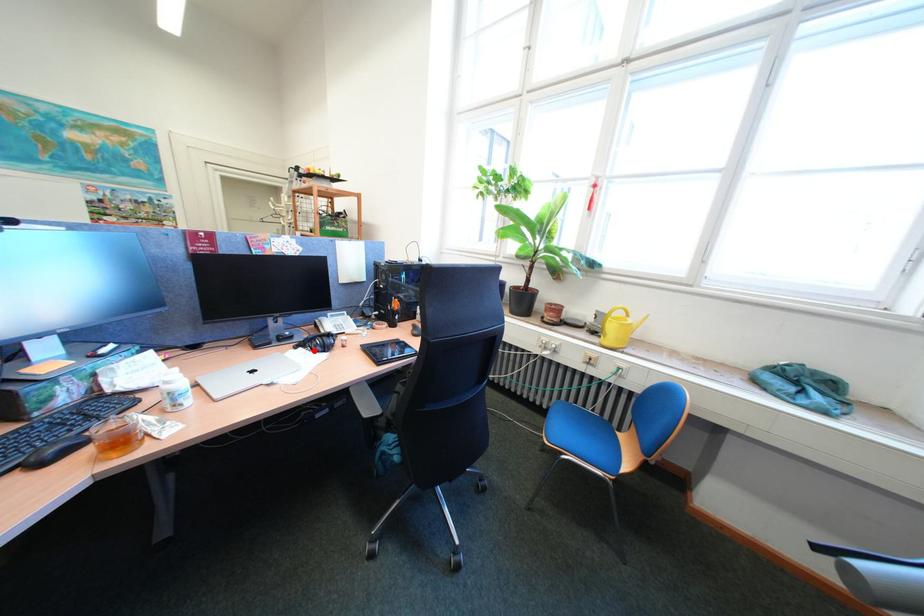
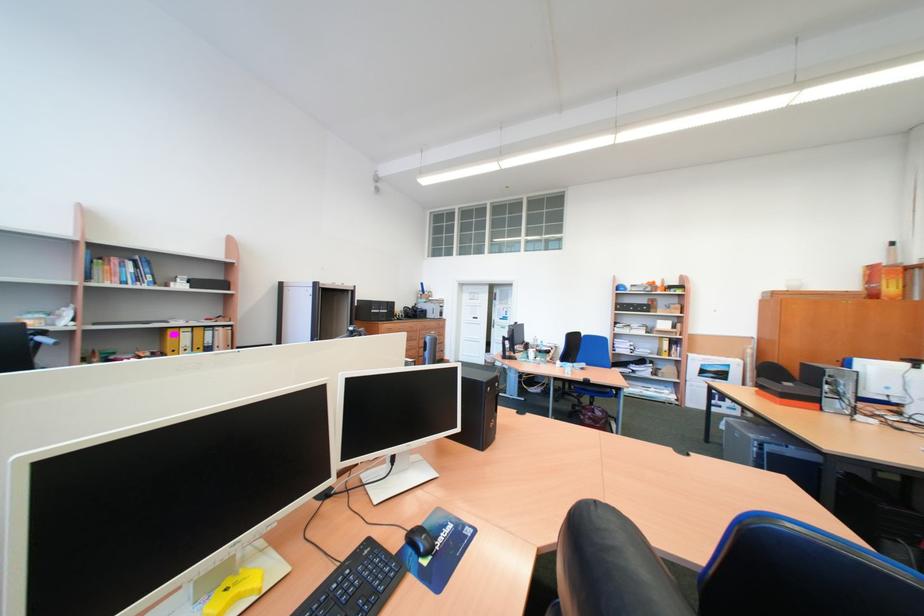
Question: I am providing you with two images of the same scene from different viewpoints. A red point is marked on the first image. Is the red point's position out of view in image 2?

Choices:
 (A) Yes
 (B) No

Answer: (A)